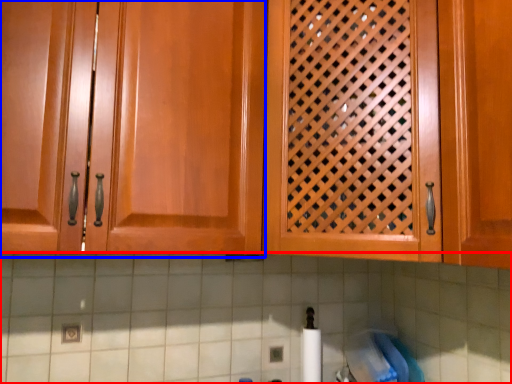
Question: Among these objects, which one is farthest to the camera, granite (highlighted by a red box) or cabinetry (highlighted by a blue box)?

Choices:
 (A) granite
 (B) cabinetry

Answer: (A)